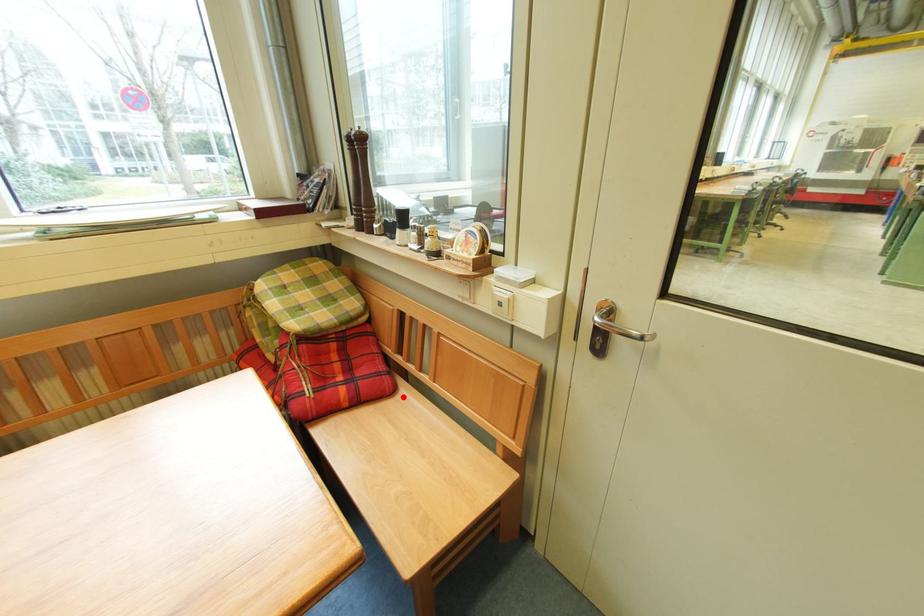
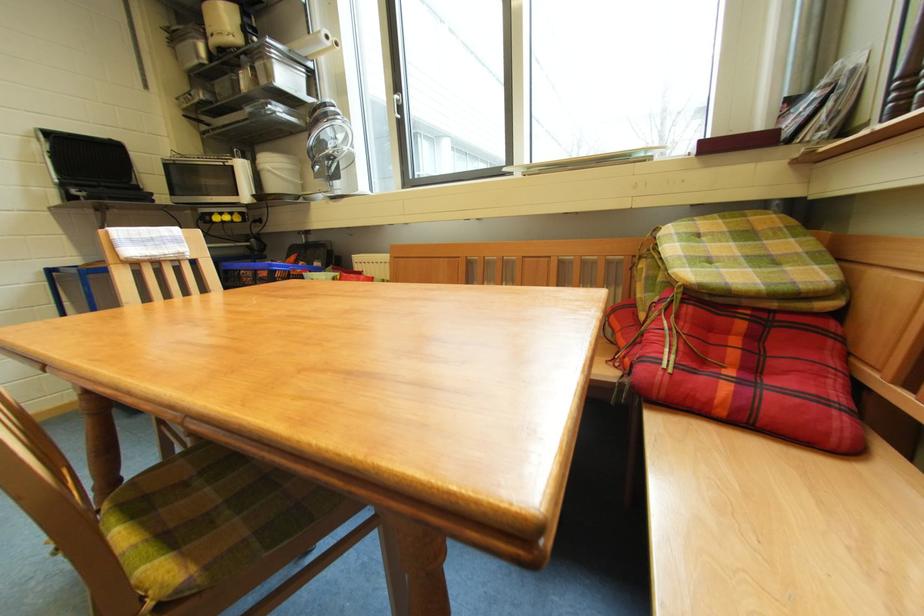
Locate, in the second image, the point that corresponds to the highlighted location in the first image.

(864, 463)